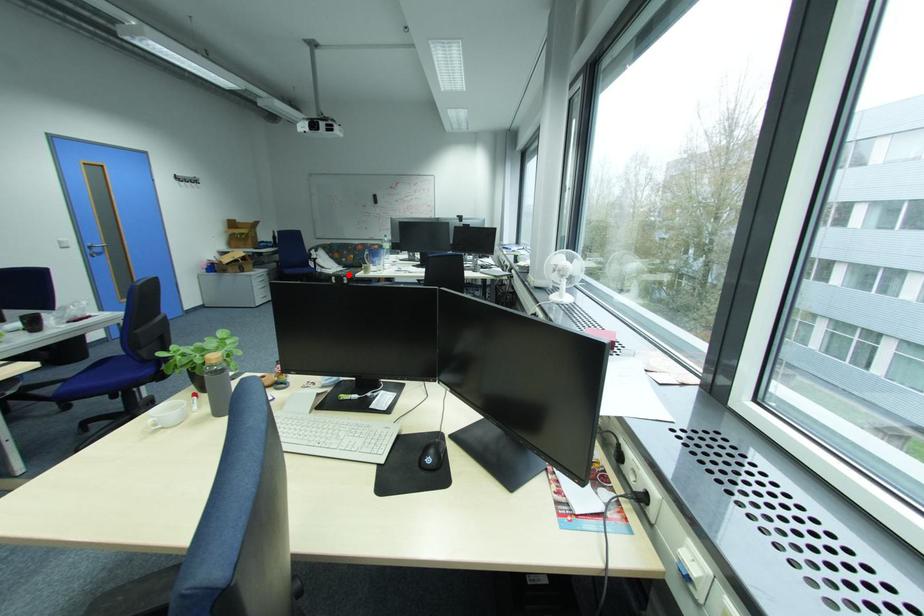
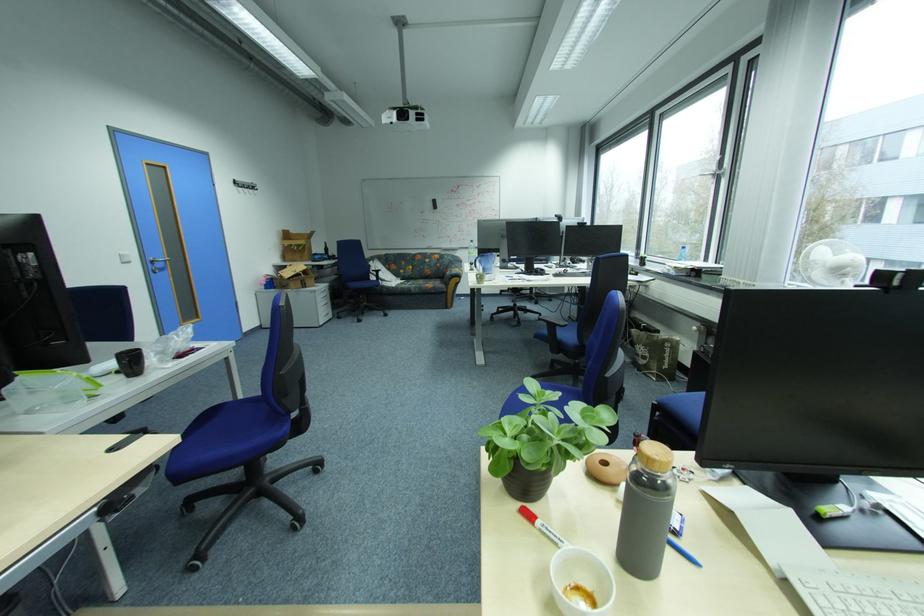
Question: A red point is marked in image1. In image2, is the corresponding 3D point closer to the camera or farther? Reply with the corresponding letter.

Choices:
 (A) The corresponding 3D point is closer.
 (B) The corresponding 3D point is farther.

Answer: (A)